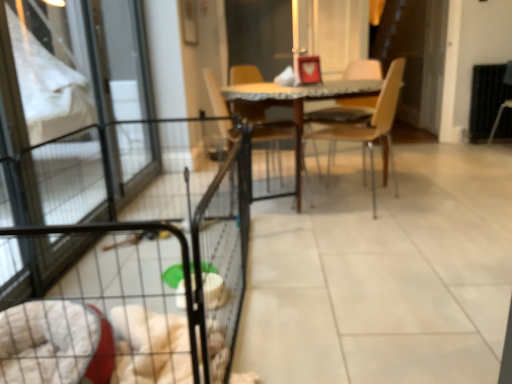
At what (x,y) coordinates should I click in order to perform the action: click on free space to the left of dark brown leather armchair at right. Please return your answer as a coordinate pair (x, y). The height and width of the screenshot is (384, 512). Looking at the image, I should click on (483, 146).